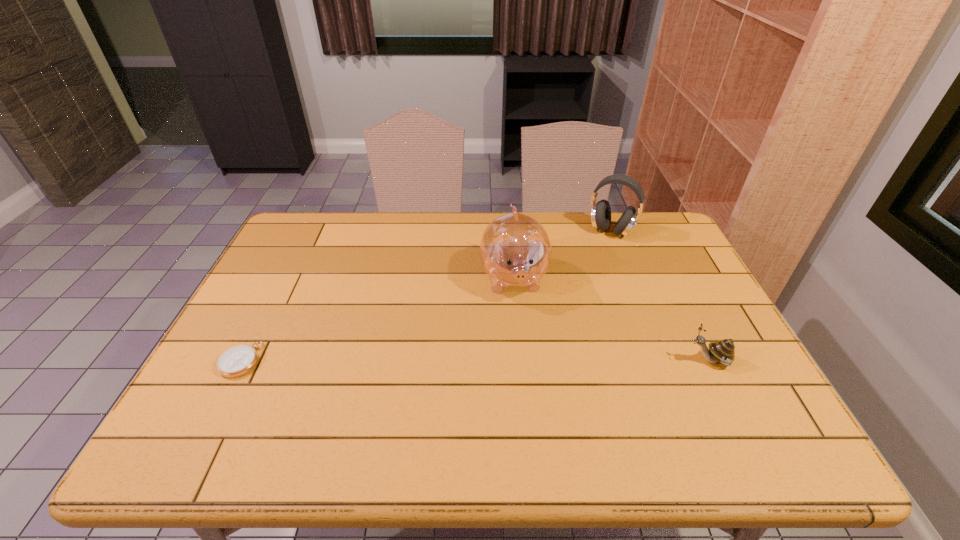
Find the location of a particular element. vacant space on the desktop that is between the leftmost object and the second shortest object and is positioned on the front facing side of the second farthest object is located at coordinates (527, 360).

I want to click on free space on the desktop that is between the shortest object and the third tallest object and is positioned on the ear cups of the farthest object, so click(522, 360).